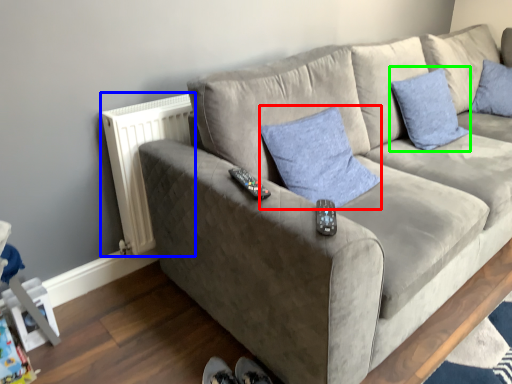
Question: Which object is positioned closest to pillow (highlighted by a red box)? Select from radiator (highlighted by a blue box) and pillow (highlighted by a green box).

Choices:
 (A) radiator
 (B) pillow

Answer: (A)